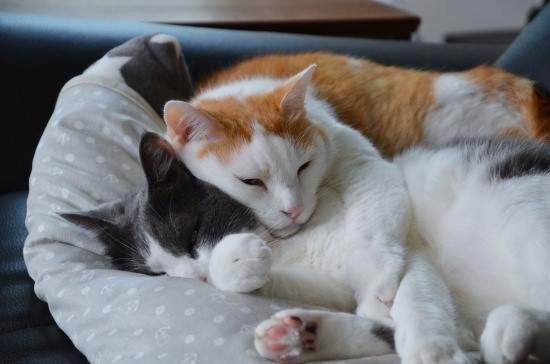
Find the location of a particular element. table is located at coordinates (272, 19).